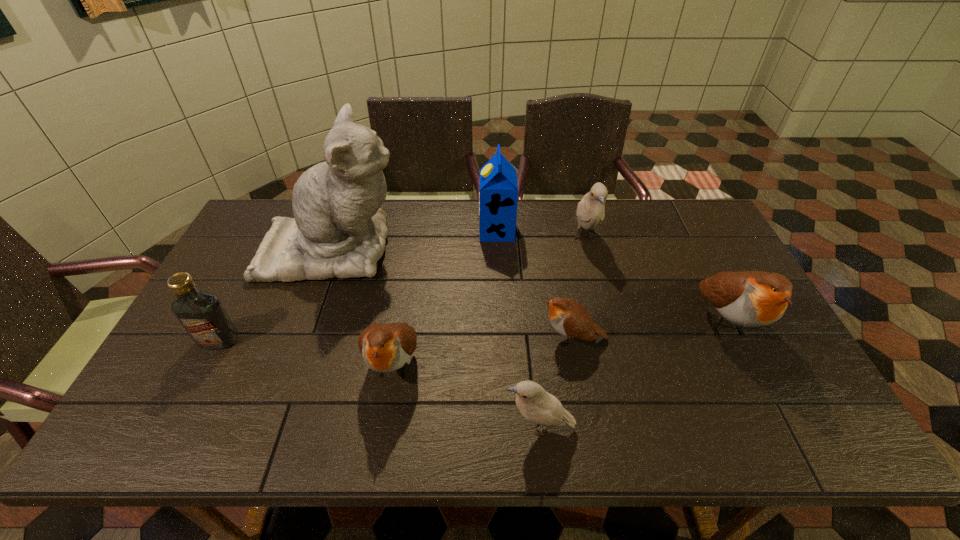
You are a GUI agent. You are given a task and a screenshot of the screen. Output one action in this format:
    pyautogui.click(x=<x>, y=<y>)
    Task: Click on the object that is the fifth closest one to the carton
    
    Given the screenshot: What is the action you would take?
    pyautogui.click(x=748, y=298)

Select which object appears as the sixth closest to the shortest object. Please provide its 2D coordinates. Your answer should be formatted as a tuple, i.e. [(x, y)], where the tuple contains the x and y coordinates of a point satisfying the conditions above.

[(339, 230)]

The height and width of the screenshot is (540, 960). I want to click on bird that is the closest to the cat, so click(x=387, y=347).

Locate an element on the screen. bird identified as the closest to the smallest brown bird is located at coordinates (535, 404).

Identify the location of brown bird that is the closest to the bigger white bird. (748, 298).

Identify which brown bird is located as the second nearest to the rightmost brown bird. Please provide its 2D coordinates. Your answer should be formatted as a tuple, i.e. [(x, y)], where the tuple contains the x and y coordinates of a point satisfying the conditions above.

[(387, 347)]

You are a GUI agent. You are given a task and a screenshot of the screen. Output one action in this format:
    pyautogui.click(x=<x>, y=<y>)
    Task: Click on the vacant region that satisfies the following two spatial constraints: 1. at the face of the rightmost object; 2. at the face of the shortest bird
    This screenshot has height=540, width=960.
    Given the screenshot: What is the action you would take?
    pyautogui.click(x=732, y=338)

In order to click on vacant area in the image that satisfies the following two spatial constraints: 1. at the face of the smallest brown bird; 2. at the face of the leftmost brown bird in this screenshot , I will do `click(577, 363)`.